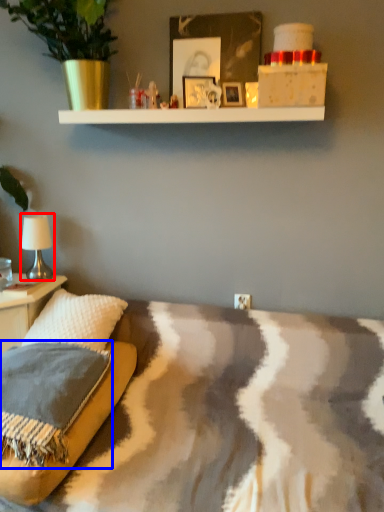
Question: Which point is closer to the camera, table lamp (highlighted by a red box) or pillow (highlighted by a blue box)?

Choices:
 (A) table lamp
 (B) pillow

Answer: (B)